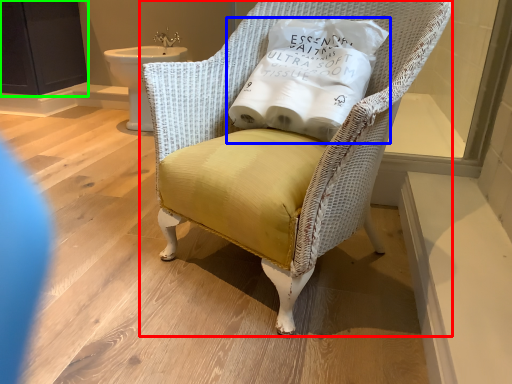
Question: Which is farther away from chair (highlighted by a red box)? pillow (highlighted by a blue box) or screen door (highlighted by a green box)?

Choices:
 (A) pillow
 (B) screen door

Answer: (B)